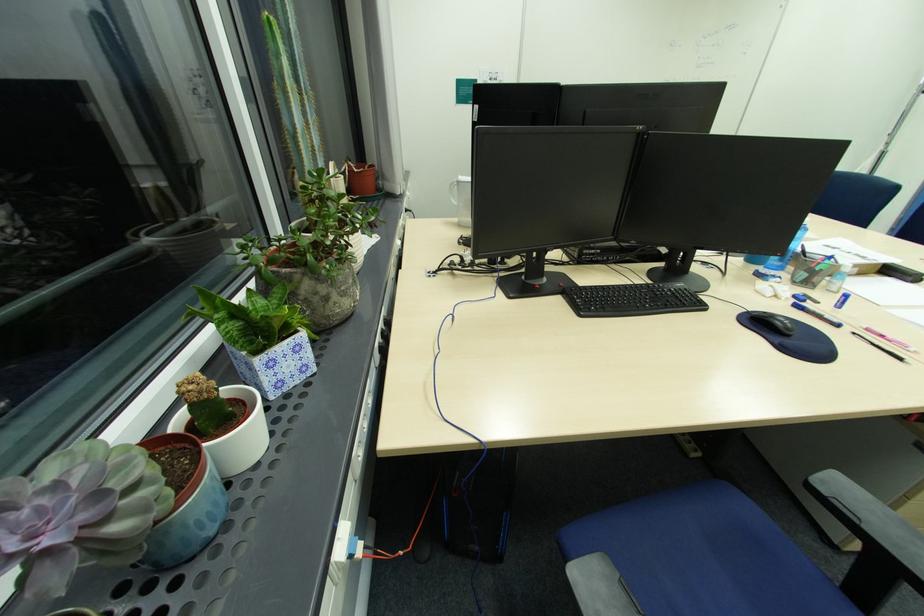
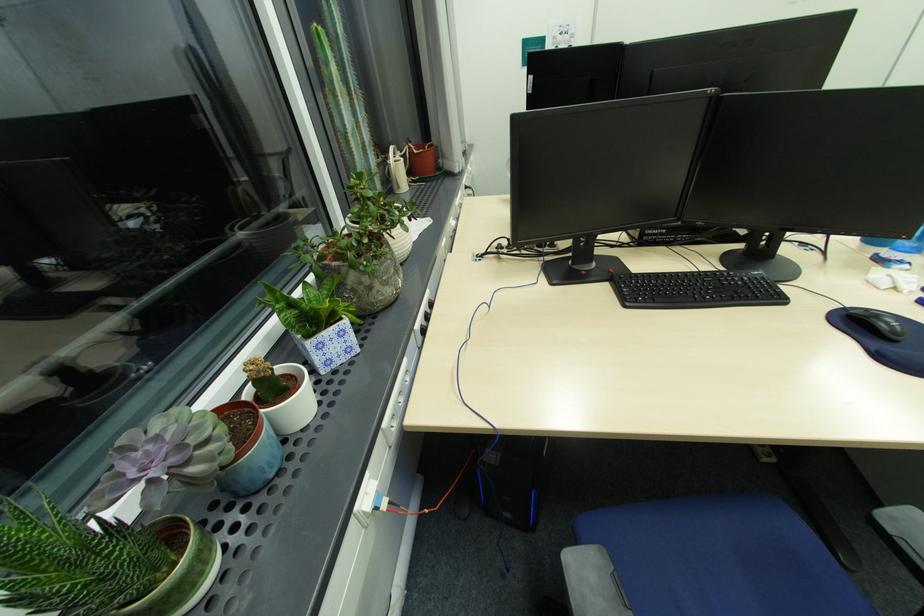
Where in the second image is the point corresponding to pixel 754 313 from the first image?

(849, 310)